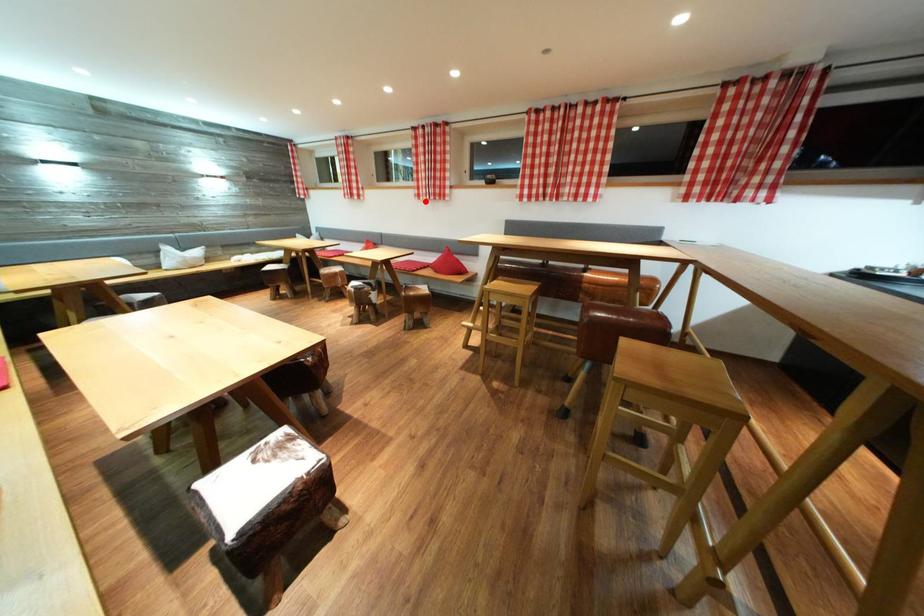
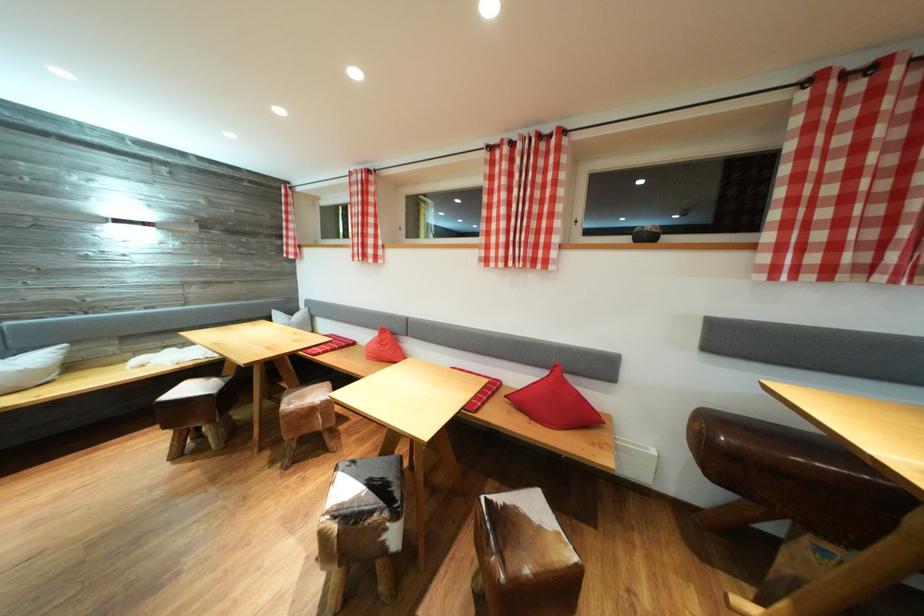
Locate, in the second image, the point that corresponds to the highlighted location in the first image.

(492, 265)